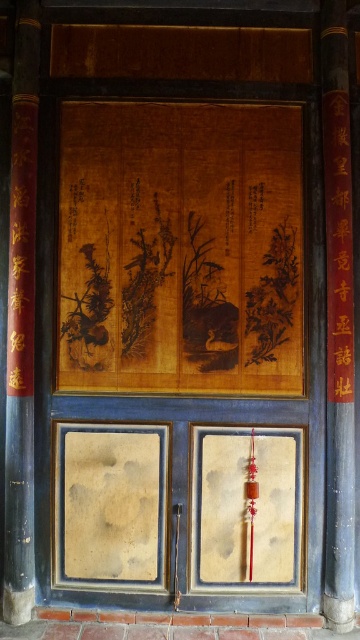
Question: Is black wood pillar at right smaller than black wood pillar at left?

Choices:
 (A) yes
 (B) no

Answer: (A)

Question: Which point is closer to the camera?

Choices:
 (A) black wood pillar at right
 (B) black wood pillar at left

Answer: (A)

Question: Among these points, which one is nearest to the camera?

Choices:
 (A) (330, 221)
 (B) (33, 132)

Answer: (A)

Question: Can you confirm if black wood pillar at right is thinner than black wood pillar at left?

Choices:
 (A) yes
 (B) no

Answer: (A)

Question: Which of the following is the farthest from the observer?

Choices:
 (A) black wood pillar at left
 (B) black wood pillar at right

Answer: (A)

Question: Can you confirm if black wood pillar at right is positioned to the right of black wood pillar at left?

Choices:
 (A) yes
 (B) no

Answer: (A)